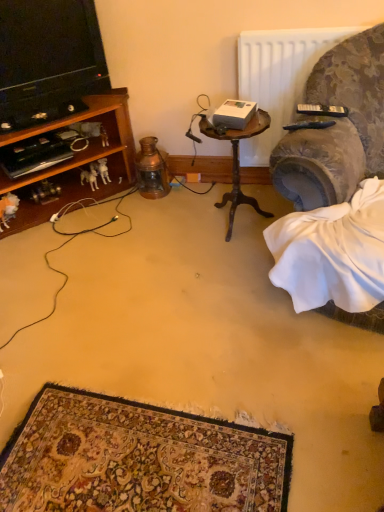
Image resolution: width=384 pixels, height=512 pixels. I want to click on vacant space in front of wooden table at center, so click(x=225, y=262).